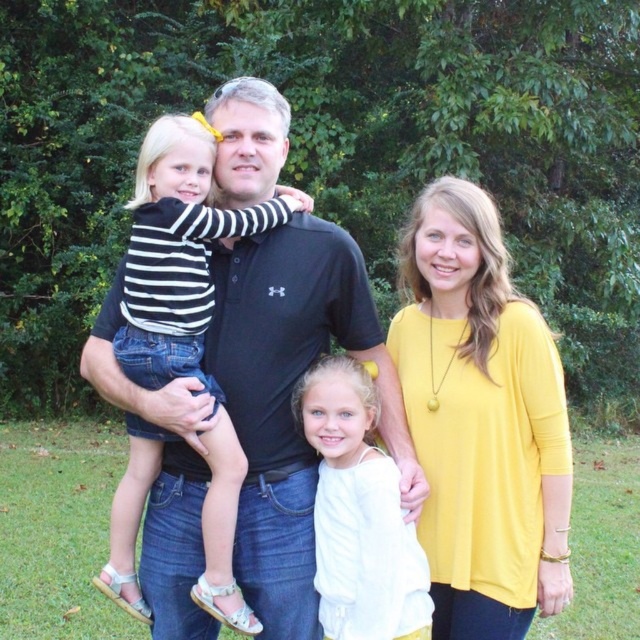
Question: Can you confirm if yellow matte top at center is thinner than white cotton shirt at center?

Choices:
 (A) no
 (B) yes

Answer: (A)

Question: Is black polo shirt at center above yellow matte top at center?

Choices:
 (A) yes
 (B) no

Answer: (A)

Question: Does black polo shirt at center appear on the left side of white cotton shirt at center?

Choices:
 (A) yes
 (B) no

Answer: (A)

Question: Estimate the real-world distances between objects in this image. Which object is closer to the yellow matte top at center?

Choices:
 (A) black polo shirt at center
 (B) white cotton shirt at center

Answer: (B)

Question: Considering the real-world distances, which object is farthest from the black polo shirt at center?

Choices:
 (A) yellow matte top at center
 (B) white cotton shirt at center

Answer: (A)

Question: Which point is farther to the camera?

Choices:
 (A) (221, 252)
 (B) (458, 442)

Answer: (A)